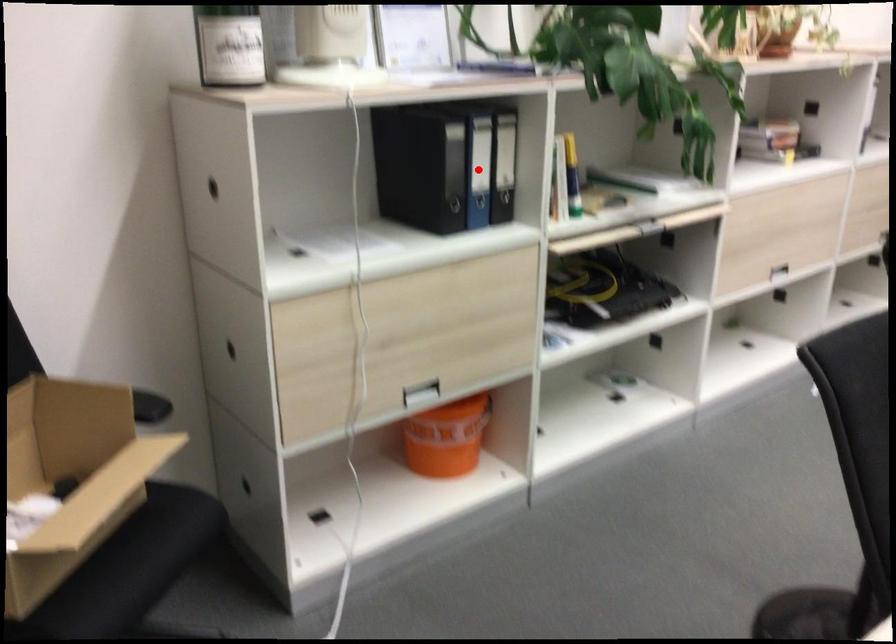
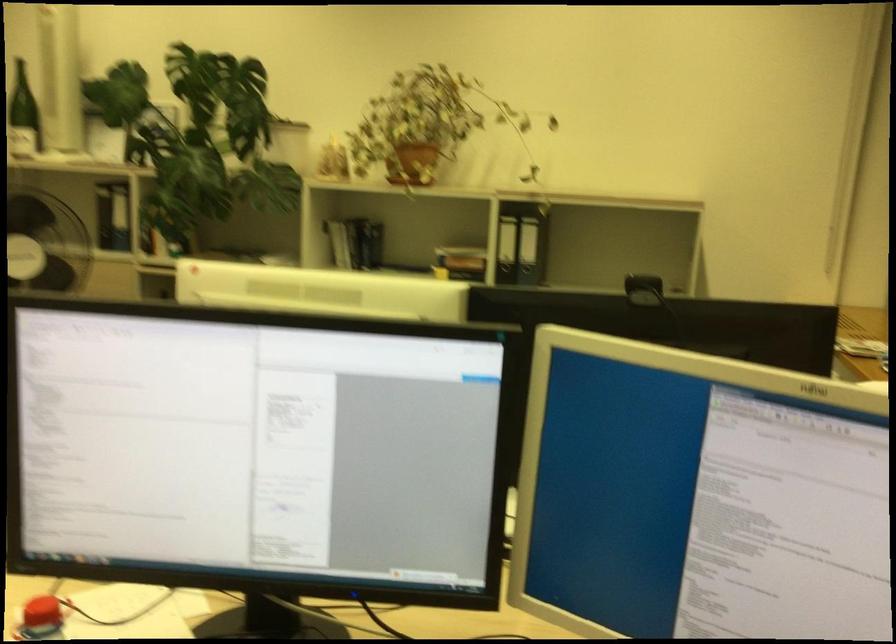
Question: I am providing you with two images of the same scene from different viewpoints. A red point is marked on the first image. At the location where the point appears in image 1, is it still visible in image 2?

Choices:
 (A) Yes
 (B) No

Answer: (B)